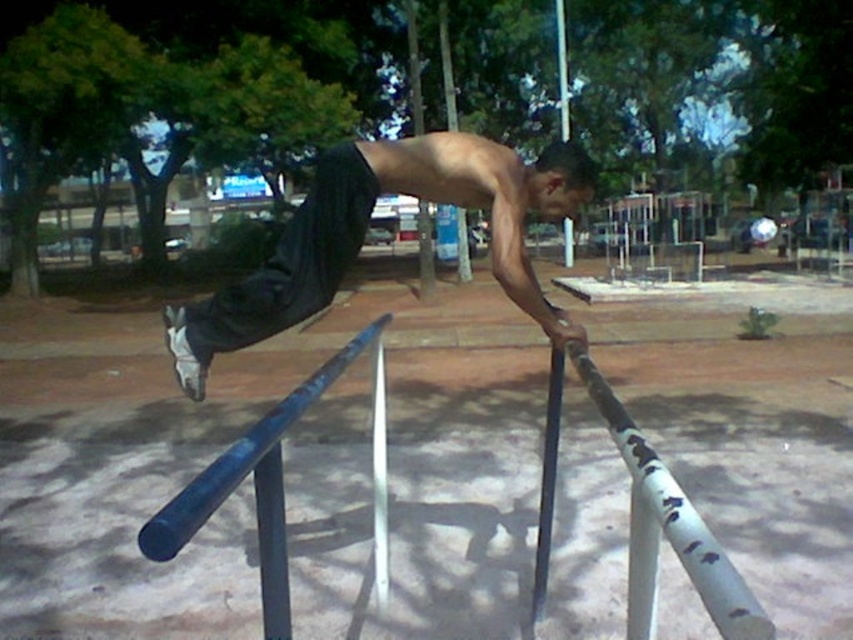
Question: Among these points, which one is farthest from the camera?

Choices:
 (A) (250, 472)
 (B) (701, 532)
 (C) (387, 589)
 (D) (546, 433)

Answer: (C)

Question: Among these points, which one is nearest to the camera?

Choices:
 (A) (453, 189)
 (B) (653, 513)

Answer: (B)

Question: Is smooth metal pole at center positioned before white painted wood pole at upper center?

Choices:
 (A) no
 (B) yes

Answer: (B)

Question: Observing the image, what is the correct spatial positioning of white painted wood pole at center in reference to brushed metal pole at center?

Choices:
 (A) left
 (B) right

Answer: (B)

Question: Which object is farther from the camera taking this photo?

Choices:
 (A) blue painted metal rail at center
 (B) smooth metal pole at center

Answer: (B)

Question: Can you confirm if blue painted metal rail at center is thinner than brushed metal pole at center?

Choices:
 (A) yes
 (B) no

Answer: (A)